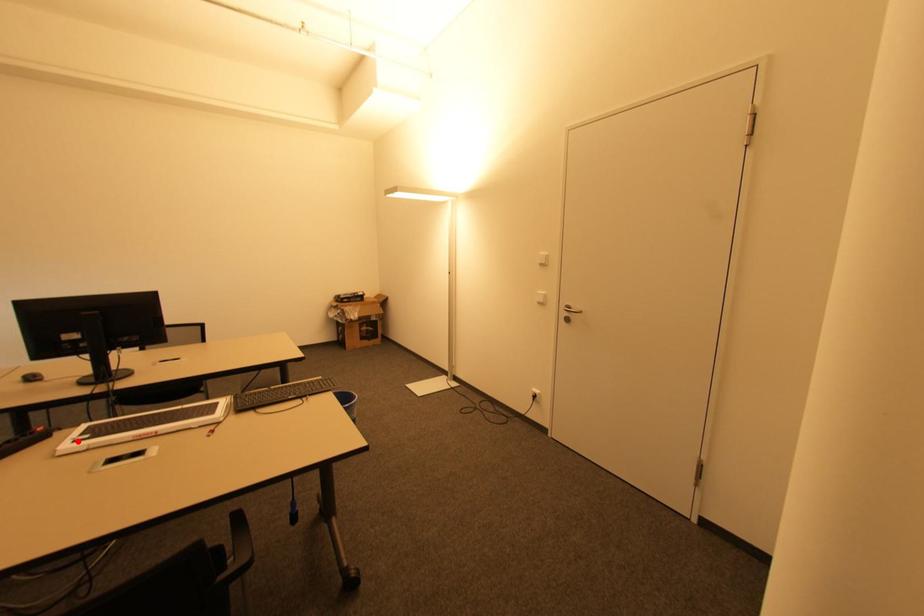
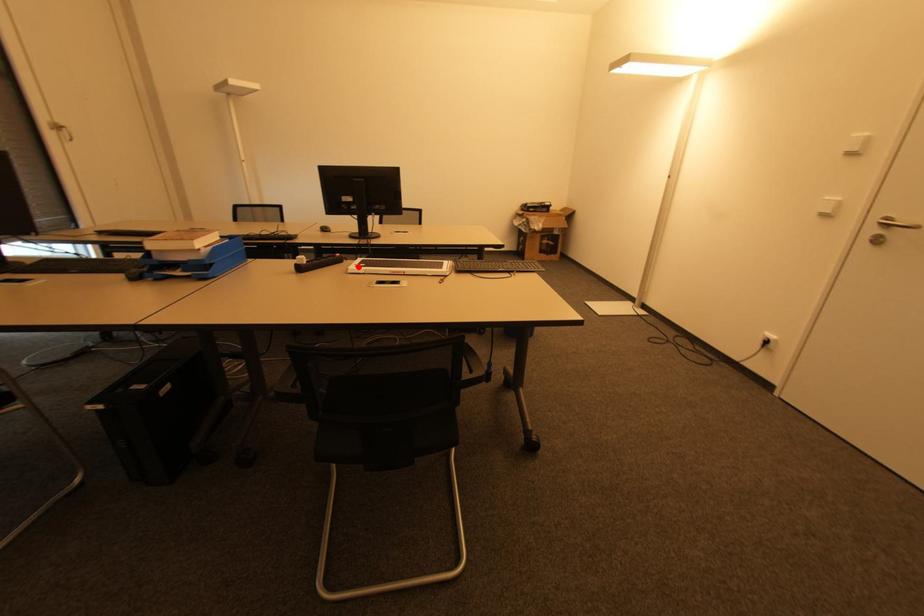
I am providing you with two images of the same scene from different viewpoints. A red point is marked on the first image and another point is marked on the second image. Is the marked point in image1 the same physical position as the marked point in image2?

Yes